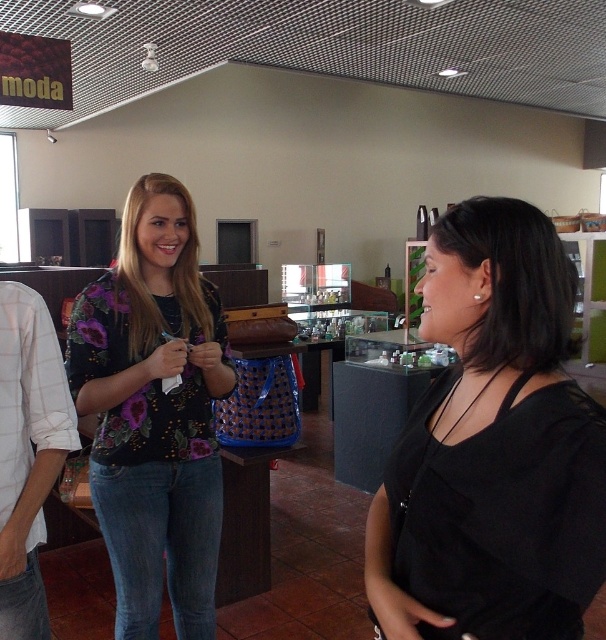
You are a customer in the store and want to find the black matte shirt at center. According to the store layout, where should you look relative to the shelves in the background?

The black matte shirt at center is located at point (493,448), which is in the foreground near the center of the image, so you should look towards the middle area of the store, closer to where the two women are standing rather than the shelves in the background.